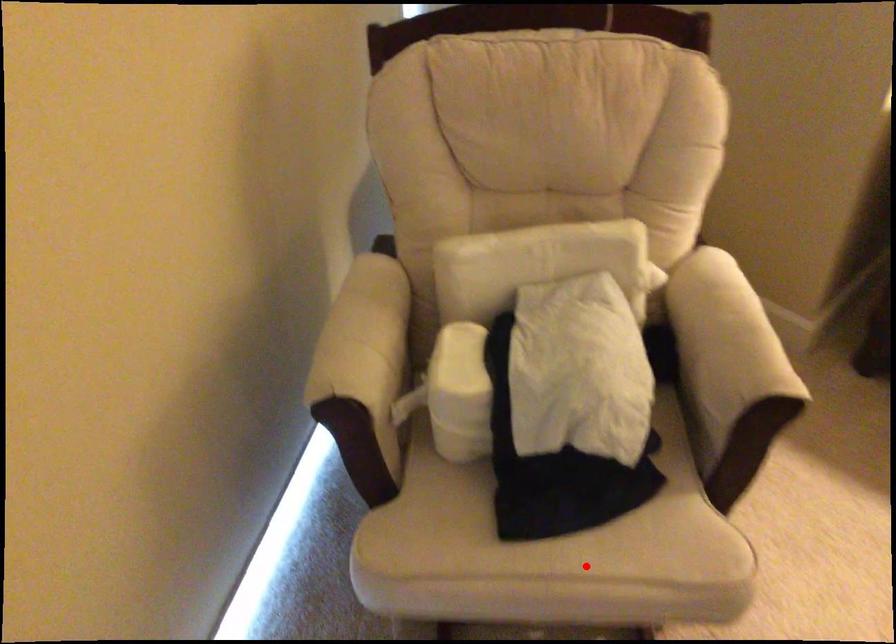
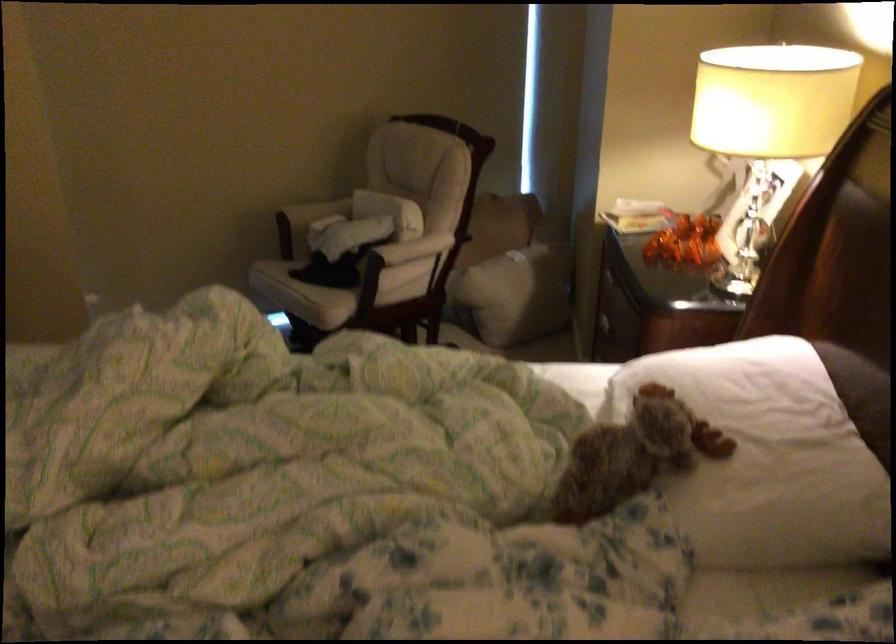
Question: I am providing you with two images of the same scene from different viewpoints. In image1, a red point is highlighted. Considering the same 3D point in image2, which of the following is correct?

Choices:
 (A) It is closer
 (B) It is farther

Answer: (B)